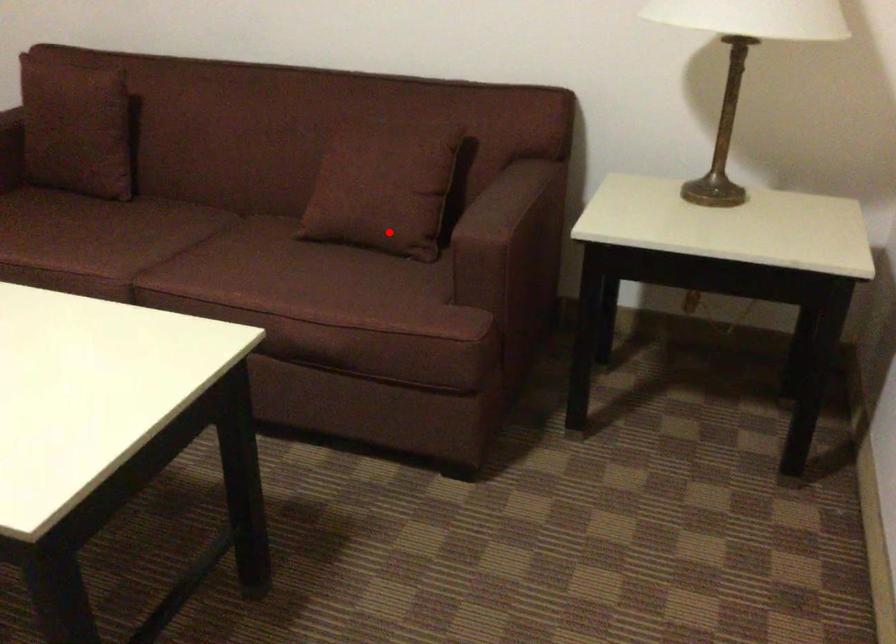
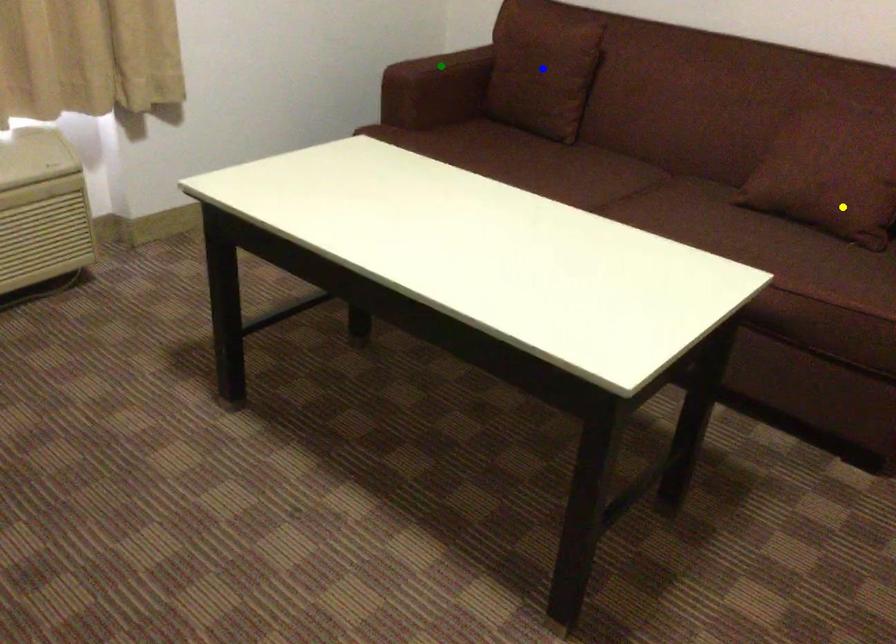
Question: I am providing you with two images of the same scene from different viewpoints. A red point is marked on the first image. You are given multiple points on the second image. Which spot in image 2 lines up with the point in image 1?

Choices:
 (A) yellow point
 (B) green point
 (C) blue point

Answer: (A)